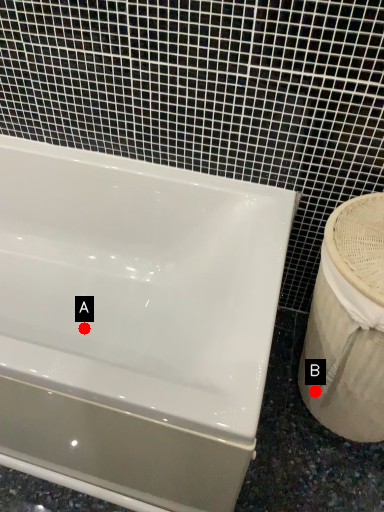
Question: Two points are circled on the image, labeled by A and B beside each circle. Which point is closer to the camera?

Choices:
 (A) A is closer
 (B) B is closer

Answer: (B)